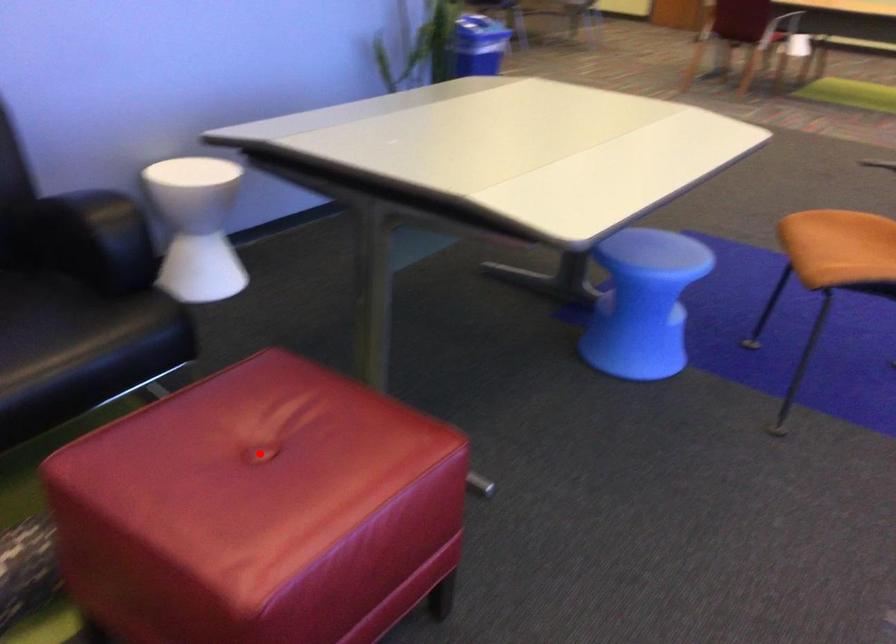
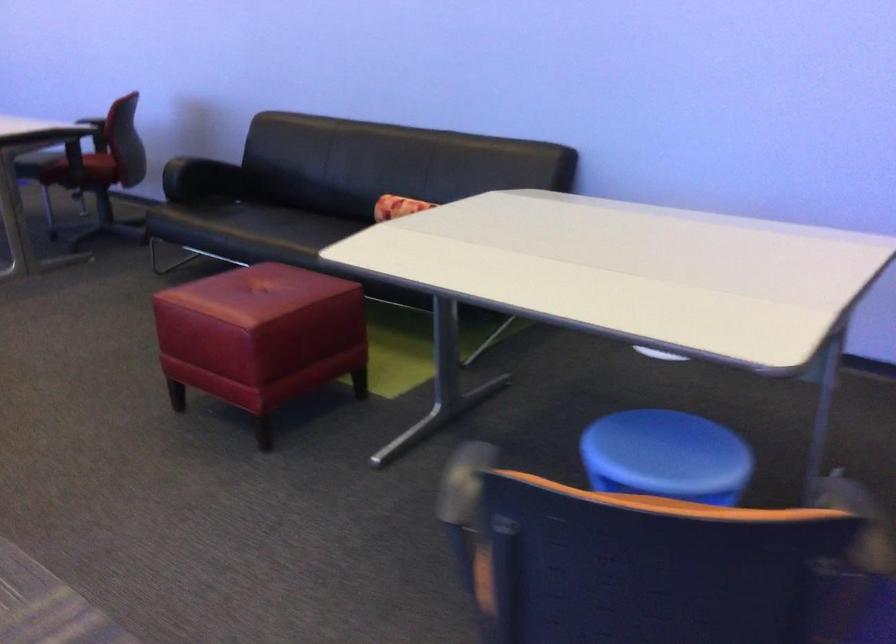
Question: I am providing you with two images of the same scene from different viewpoints. In image1, a red point is highlighted. Considering the same 3D point in image2, which of the following is correct?

Choices:
 (A) It is closer
 (B) It is farther

Answer: (B)